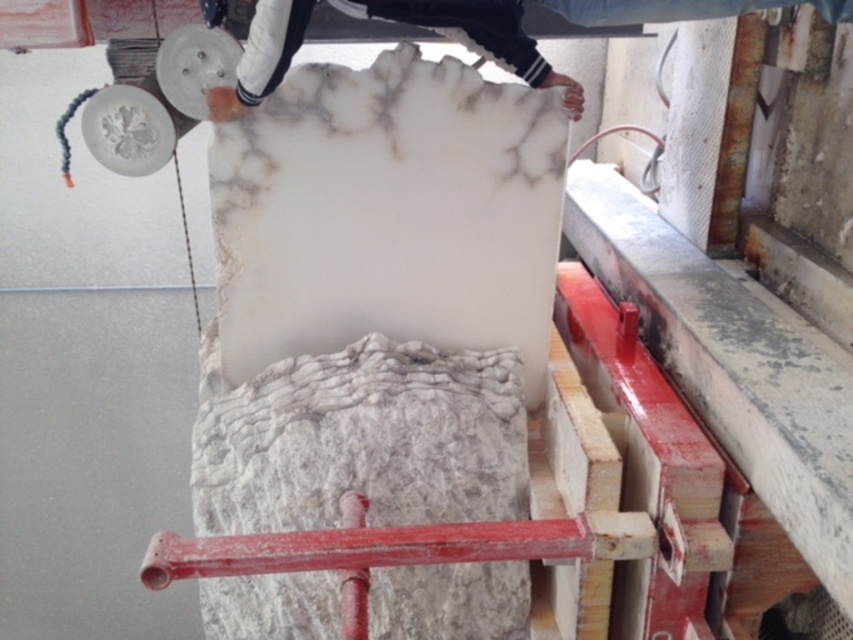
Between point (223, 397) and point (538, 81), which one is positioned in front?

Point (538, 81) is in front.

Who is more distant from viewer, (445,396) or (258,26)?

The point (445,396) is behind.

Where is `white marble at center`? The image size is (853, 640). white marble at center is located at coordinates 363,440.